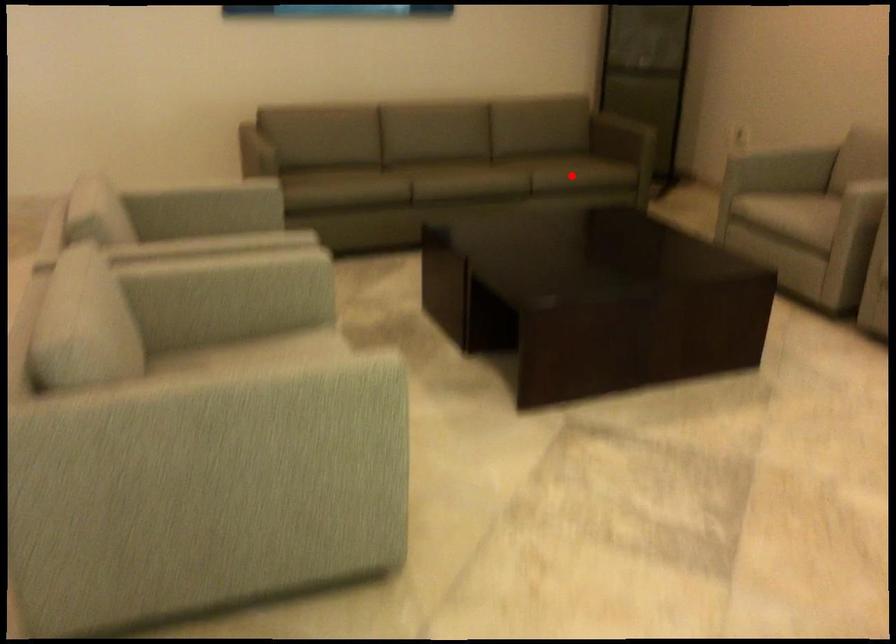
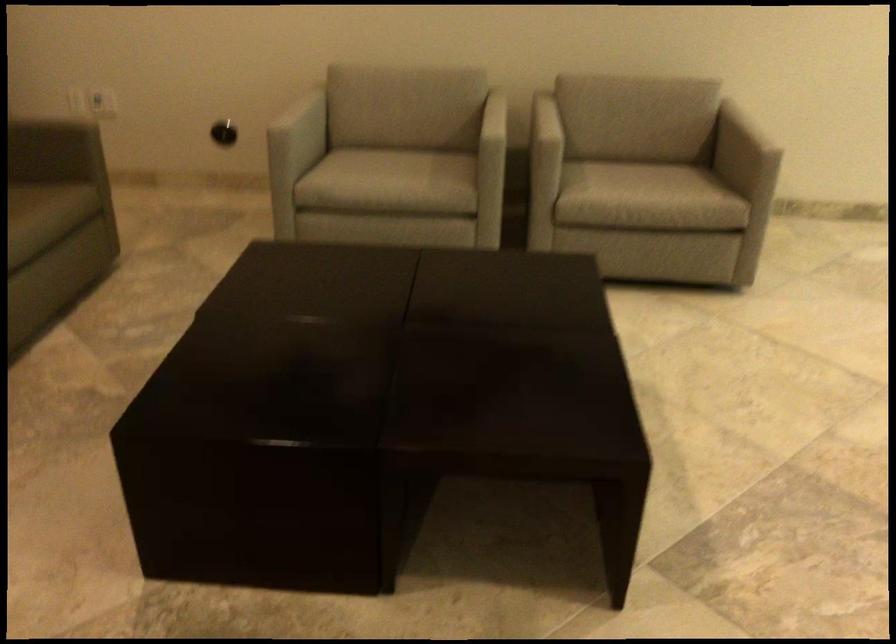
Find the pixel in the second image that matches the highlighted location in the first image.

(36, 219)